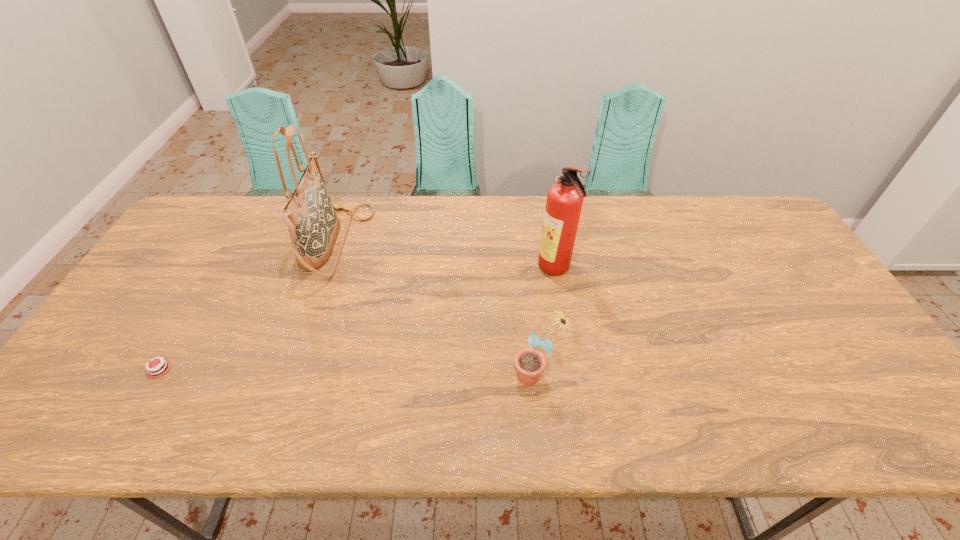
Point out which object is positioned as the nearest to the second shortest object. Please provide its 2D coordinates. Your answer should be formatted as a tuple, i.e. [(x, y)], where the tuple contains the x and y coordinates of a point satisfying the conditions above.

[(564, 202)]

You are a GUI agent. You are given a task and a screenshot of the screen. Output one action in this format:
    pyautogui.click(x=<x>, y=<y>)
    Task: Click on the third closest object relative to the leftmost object
    The image size is (960, 540).
    Given the screenshot: What is the action you would take?
    pyautogui.click(x=564, y=202)

Where is `vacant area that satisfies the following two spatial constraints: 1. on the front-facing side of the handbag; 2. on the front side of the chocolate cake`? The height and width of the screenshot is (540, 960). vacant area that satisfies the following two spatial constraints: 1. on the front-facing side of the handbag; 2. on the front side of the chocolate cake is located at coordinates (292, 369).

I want to click on vacant space that satisfies the following two spatial constraints: 1. on the front-facing side of the third object from right to left; 2. on the front side of the shortest object, so click(292, 369).